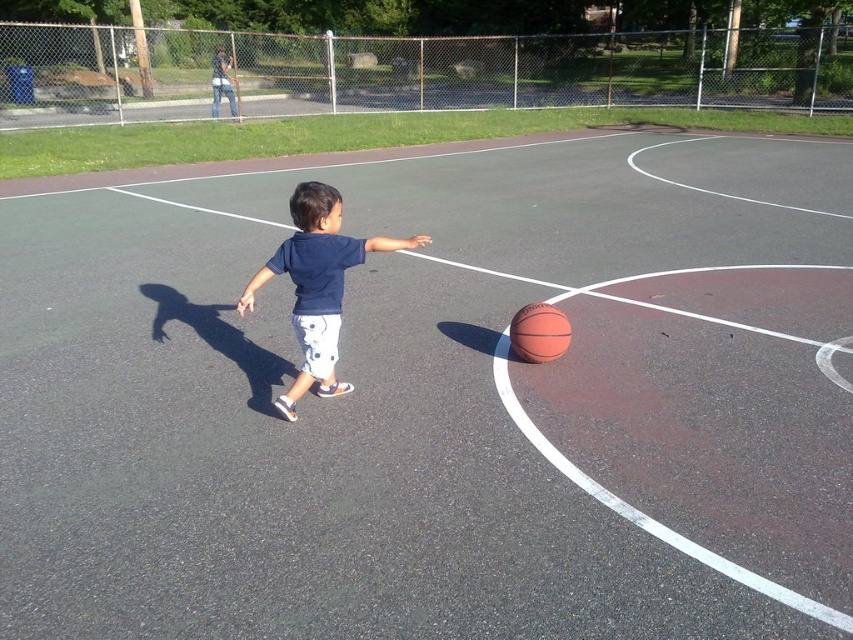
Is point (370, 244) positioned before point (529, 353)?

Yes, it is.

Can you confirm if dark blue cotton shirt at center is positioned to the left of rubber/synthetic basketball at center?

Indeed, dark blue cotton shirt at center is positioned on the left side of rubber/synthetic basketball at center.

This screenshot has height=640, width=853. In order to click on dark blue cotton shirt at center in this screenshot , I will do `click(317, 284)`.